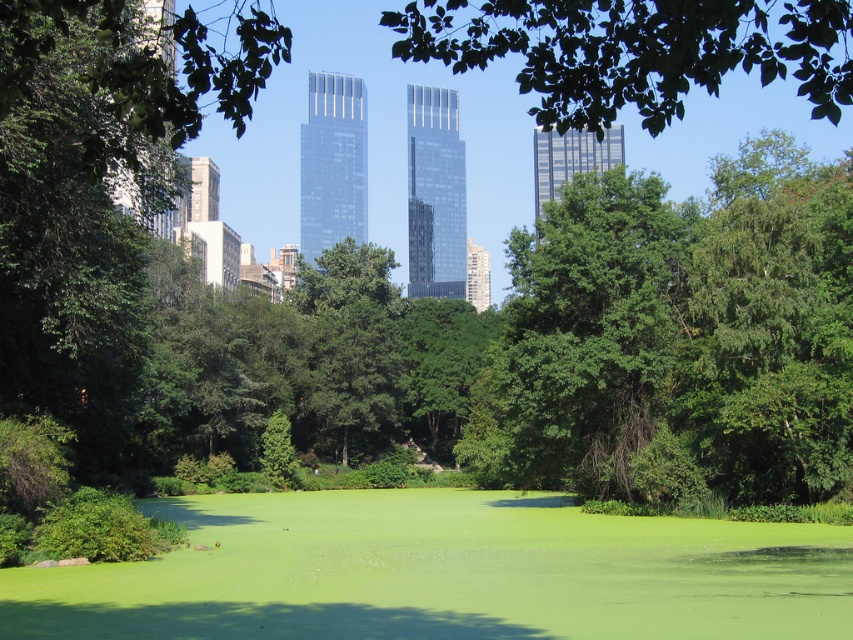
Question: Which point appears farthest from the camera in this image?

Choices:
 (A) (724, 38)
 (B) (643, 429)

Answer: (B)

Question: Does green leafy tree at center come in front of green leafy tree at upper center?

Choices:
 (A) no
 (B) yes

Answer: (A)

Question: Which point is closer to the camera?

Choices:
 (A) green leafy tree at center
 (B) green leafy tree at upper center

Answer: (B)

Question: Which object appears farthest from the camera in this image?

Choices:
 (A) green leafy tree at center
 (B) green leafy tree at upper center

Answer: (A)

Question: Can you confirm if green leafy tree at center is smaller than green leafy tree at upper center?

Choices:
 (A) yes
 (B) no

Answer: (A)

Question: Can you confirm if green leafy tree at center is wider than green leafy tree at upper center?

Choices:
 (A) no
 (B) yes

Answer: (A)